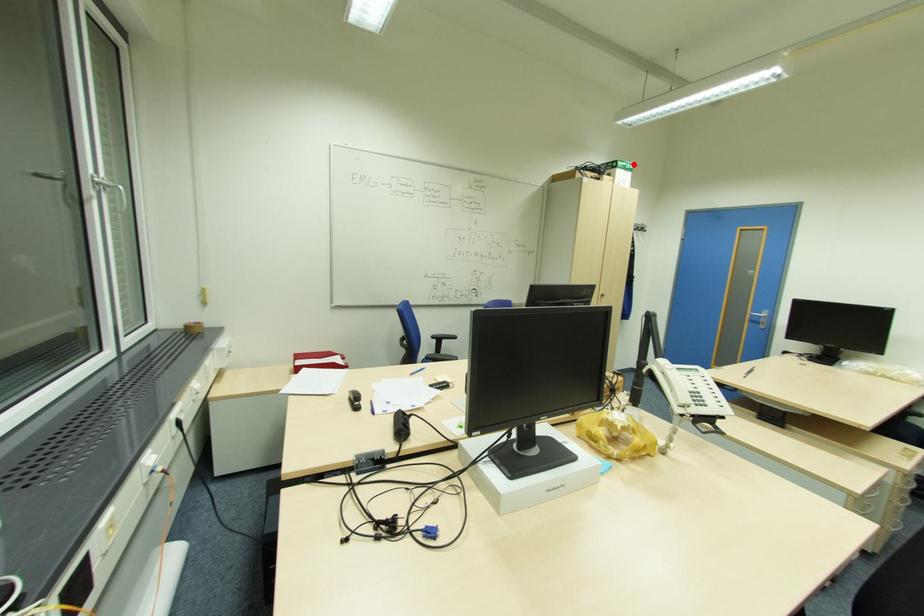
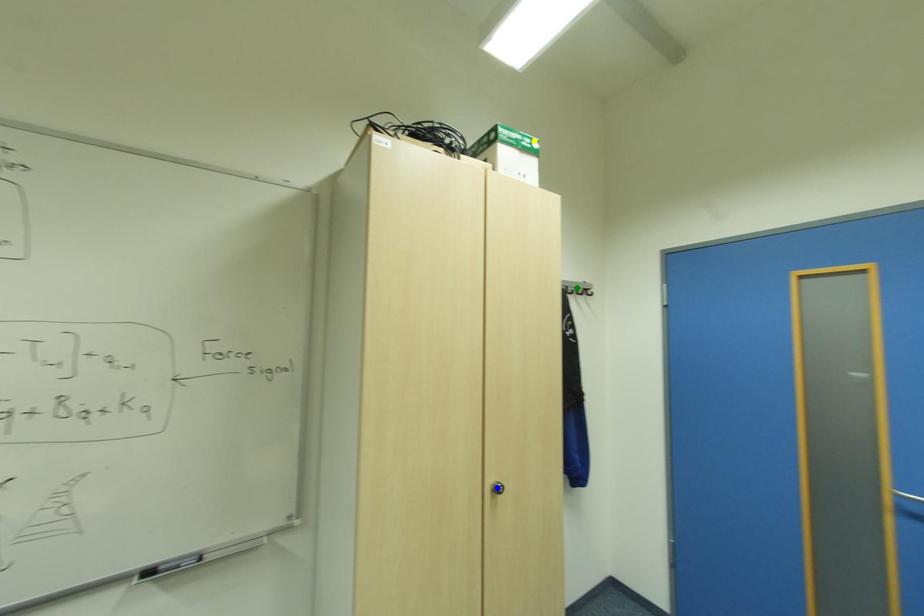
Question: I am providing you with two images of the same scene from different viewpoints. A red point is marked on the first image. You are given multiple points on the second image. Which point in image 2 is actually the same real-world point as the red point in image 1?

Choices:
 (A) green point
 (B) blue point
 (C) yellow point

Answer: (C)